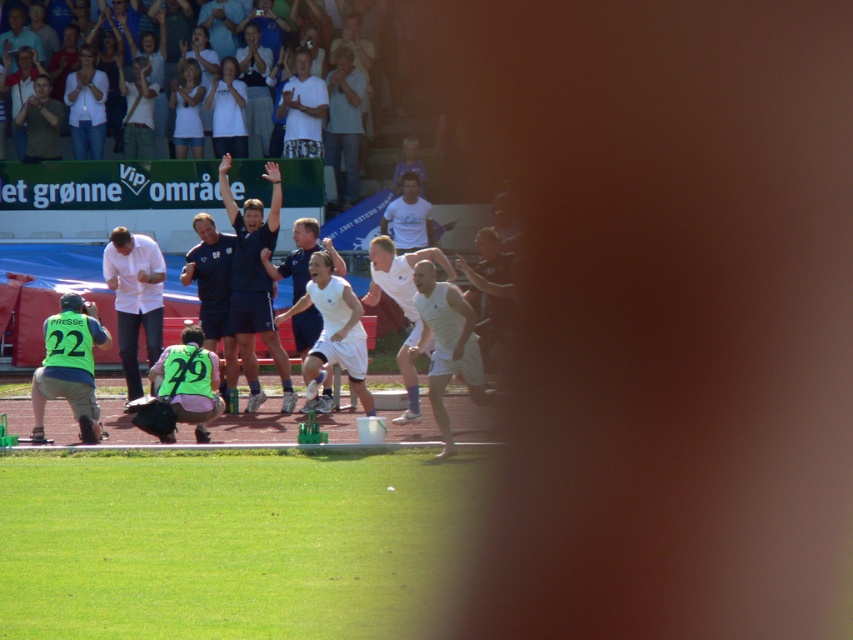
You are a photographer at the stadium and want to capture both the white matte shirt at upper center and the camouflage shirt at upper left in your shot. Which one is nearer to you?

The white matte shirt at upper center is closer to the viewer than the camouflage shirt at upper left.

You are a photographer at the sports event and want to capture both the neon green jersey at lower left and the white matte tank top at center in a single frame. Considering their sizes, which one might appear larger in the photo?

The neon green jersey at lower left will appear larger in the photo because it is bigger than the white matte tank top at center.